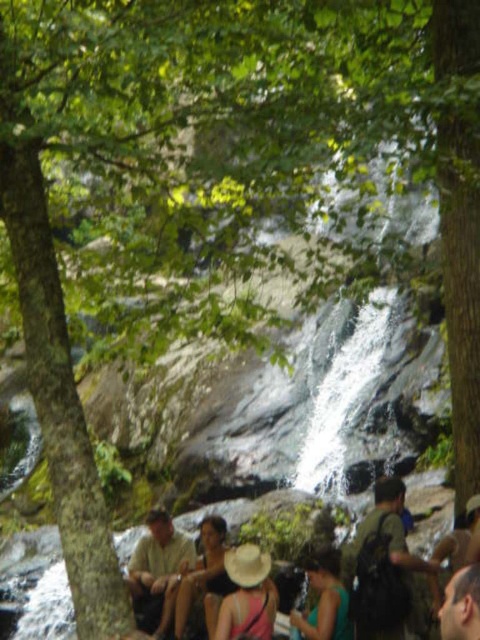
Is point (352, 410) positioned after point (311, 573)?

Yes, point (352, 410) is behind point (311, 573).

Does white frothy water at center appear over green matte dress at center?

Yes.

Which is behind, point (344, 355) or point (325, 563)?

The point (344, 355) is more distant.

You are a GUI agent. You are given a task and a screenshot of the screen. Output one action in this format:
    pyautogui.click(x=<x>, y=<y>)
    Task: Click on the white frothy water at center
    The image size is (480, 640).
    Given the screenshot: What is the action you would take?
    pyautogui.click(x=343, y=394)

Is light brown fabric shirt at lower left positioned before beige straw hat at center?

No.

Is light brown fabric shirt at lower left taller than beige straw hat at center?

No, light brown fabric shirt at lower left is not taller than beige straw hat at center.

This screenshot has width=480, height=640. I want to click on light brown fabric shirt at lower left, so click(x=157, y=572).

Is white frothy water at center below beige straw hat at center?

Actually, white frothy water at center is above beige straw hat at center.

Looking at this image, is white frothy water at center to the right of beige straw hat at center from the viewer's perspective?

Yes, white frothy water at center is to the right of beige straw hat at center.

Is point (299, 435) in front of point (241, 592)?

No, (299, 435) is further to viewer.

In order to click on white frothy water at center in this screenshot , I will do `click(343, 394)`.